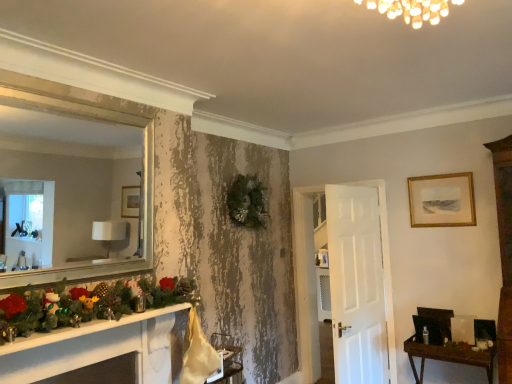
Question: From the image's perspective, relative to gold-framed painting at upper right, is brown wooden table at lower right above or below?

Choices:
 (A) below
 (B) above

Answer: (A)

Question: From a real-world perspective, is brown wooden table at lower right physically located above or below gold-framed painting at upper right?

Choices:
 (A) below
 (B) above

Answer: (A)

Question: Looking at their shapes, would you say brown wooden table at lower right is wider or thinner than gold-framed painting at upper right?

Choices:
 (A) wide
 (B) thin

Answer: (A)

Question: Is gold-framed painting at upper right spatially inside brown wooden table at lower right, or outside of it?

Choices:
 (A) outside
 (B) inside

Answer: (A)

Question: Looking at the image, does gold-framed painting at upper right seem bigger or smaller compared to brown wooden table at lower right?

Choices:
 (A) big
 (B) small

Answer: (B)

Question: In terms of height, does gold-framed painting at upper right look taller or shorter compared to brown wooden table at lower right?

Choices:
 (A) tall
 (B) short

Answer: (B)

Question: From a real-world perspective, is gold-framed painting at upper right physically located above or below brown wooden table at lower right?

Choices:
 (A) above
 (B) below

Answer: (A)